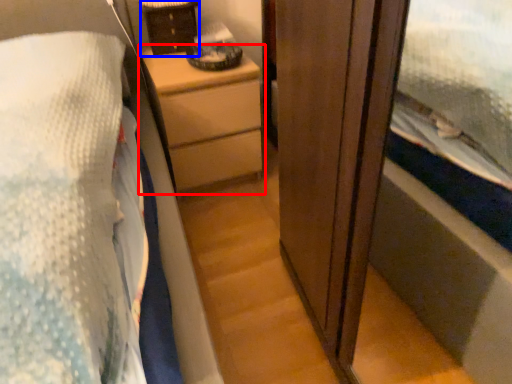
Question: Which object is further to the camera taking this photo, chest of drawers (highlighted by a red box) or cabinetry (highlighted by a blue box)?

Choices:
 (A) chest of drawers
 (B) cabinetry

Answer: (B)